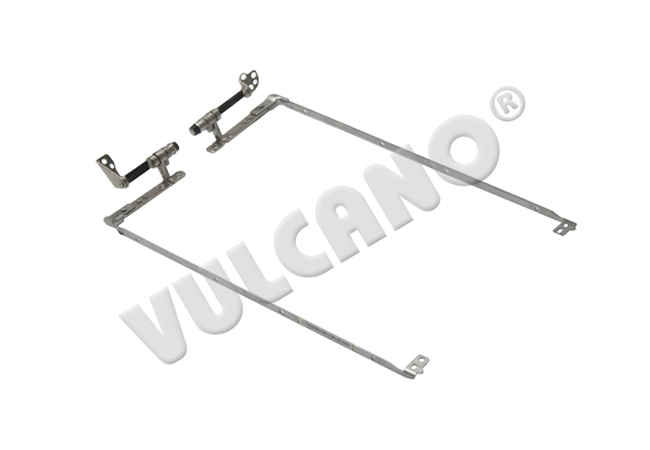
The height and width of the screenshot is (450, 650). I want to click on right upper knob, so click(x=257, y=74).